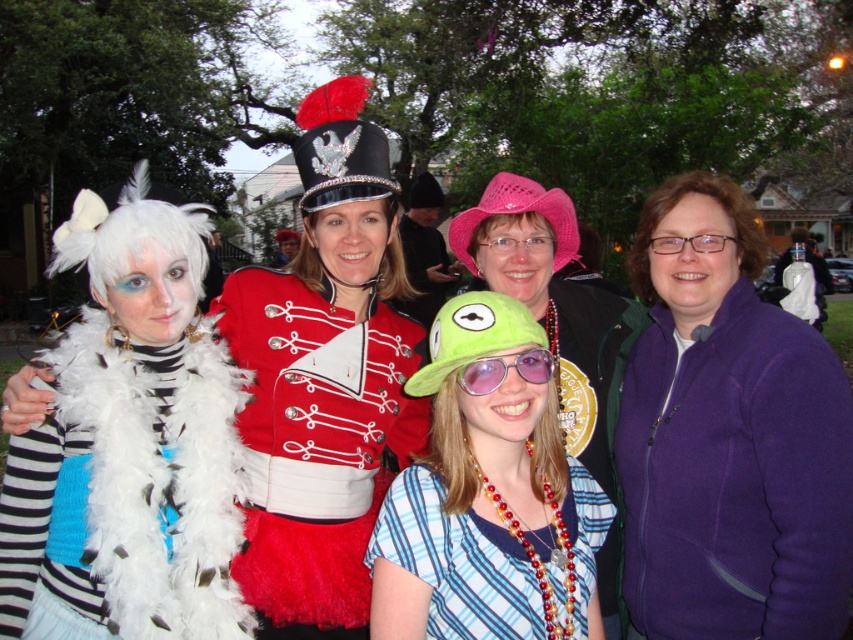
You are organizing a costume party and need to arrange the green felt hat at center and the red velvet jacket at center on a shelf. If the shelf has limited space, which item should you place first to ensure both fit?

The green felt hat at center occupies less space than the red velvet jacket at center, so place the red velvet jacket at center first to ensure both items fit on the shelf.

There are two objects in the scene described as the green felt hat at center and the blue top at lower left. How far apart are these two items?

The green felt hat at center and the blue top at lower left are 2.13 meters apart.

You are standing in front of the group of five people. Where exactly is the purple fleece jacket at center located in terms of coordinates?

The purple fleece jacket at center is located at coordinates point (x=728, y=436).